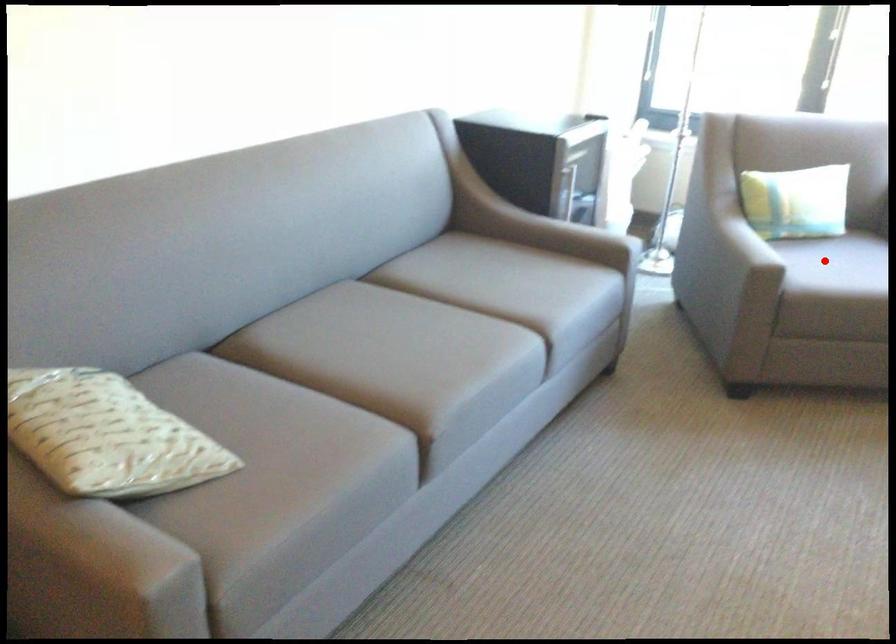
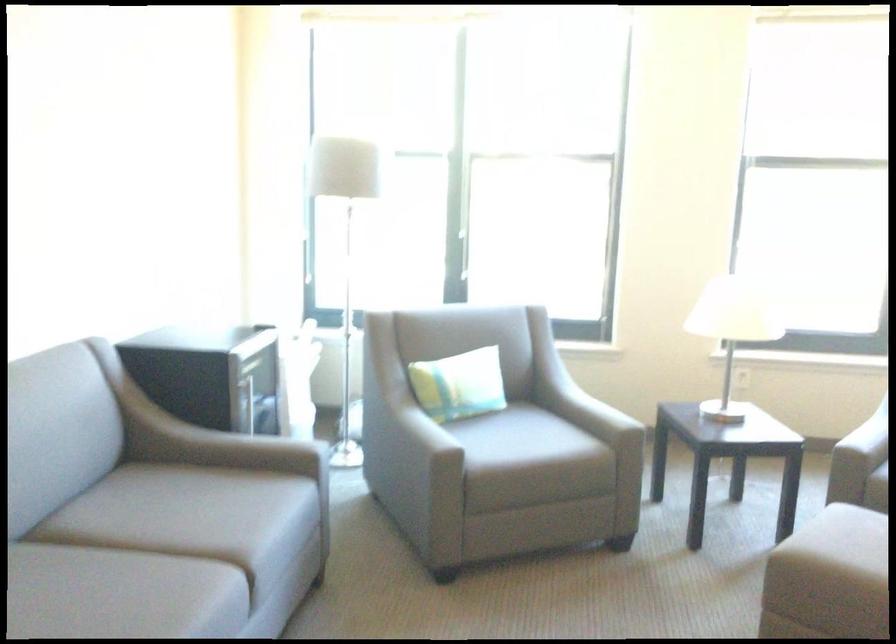
Question: I am providing you with two images of the same scene from different viewpoints. Given a red point in image1, look at the same physical point in image2. Is it:

Choices:
 (A) Closer to the viewpoint
 (B) Farther from the viewpoint

Answer: (B)